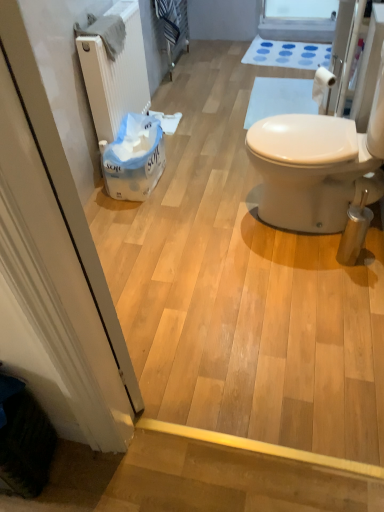
Where is `transparent plastic window screen at upper center`? The height and width of the screenshot is (512, 384). transparent plastic window screen at upper center is located at coordinates (298, 20).

Locate an element on the screen. This screenshot has width=384, height=512. white matte screen door at left is located at coordinates (53, 266).

Identify the location of white rubber bath mat at upper center. The height and width of the screenshot is (512, 384). (287, 54).

Describe the element at coordinates (167, 121) in the screenshot. I see `white soft tissue at center, placed as the first toilet paper when sorted from back to front` at that location.

The height and width of the screenshot is (512, 384). Describe the element at coordinates (115, 74) in the screenshot. I see `beige textured radiator at left` at that location.

Identify the location of transparent plastic window screen at upper center. This screenshot has height=512, width=384. (298, 20).

Between beige textured radiator at left and white matte toilet paper at upper right, positioned as the second toilet paper in left-to-right order, which one has more height?

beige textured radiator at left is taller.

Choose the correct answer: Is beige textured radiator at left inside white matte toilet paper at upper right, which is counted as the 1th toilet paper, starting from the front, or outside it?

beige textured radiator at left is outside white matte toilet paper at upper right, which is counted as the 1th toilet paper, starting from the front.

Is beige textured radiator at left positioned with its back to white matte toilet paper at upper right, which is counted as the 1th toilet paper, starting from the front?

That's not correct — beige textured radiator at left is not looking away from white matte toilet paper at upper right, which is counted as the 1th toilet paper, starting from the front.

In the scene shown: From a real-world perspective, which object stands above the other?

white matte toilet paper at upper right, which is counted as the 1th toilet paper, starting from the front.

Considering the relative sizes of white soft tissue at center, placed as the first toilet paper when sorted from back to front, and transparent plastic window screen at upper center in the image provided, is white soft tissue at center, placed as the first toilet paper when sorted from back to front, thinner than transparent plastic window screen at upper center?

Correct, the width of white soft tissue at center, placed as the first toilet paper when sorted from back to front, is less than that of transparent plastic window screen at upper center.

Considering the relative positions of white soft tissue at center, the 2th toilet paper when ordered from right to left, and transparent plastic window screen at upper center in the image provided, is white soft tissue at center, the 2th toilet paper when ordered from right to left, to the left or to the right of transparent plastic window screen at upper center?

In the image, white soft tissue at center, the 2th toilet paper when ordered from right to left, appears on the left side of transparent plastic window screen at upper center.

Between white soft tissue at center, the 2th toilet paper when ordered from right to left, and transparent plastic window screen at upper center, which one has larger size?

transparent plastic window screen at upper center is bigger.

In order to click on the 1st toilet paper in front of the transparent plastic window screen at upper center in this screenshot , I will do `click(167, 121)`.

Is transparent plastic window screen at upper center aimed at white soft tissue at center, arranged as the first toilet paper when viewed from the left?

Yes.

Can you confirm if transparent plastic window screen at upper center is taller than white soft tissue at center, arranged as the first toilet paper when viewed from the left?

Yes.

At what (x,y) coordinates should I click in order to perform the action: click on window screen lying behind the white soft tissue at center, which is the second toilet paper in front-to-back order. Please return your answer as a coordinate pair (x, y). Looking at the image, I should click on (298, 20).

Is beige textured radiator at left looking in the opposite direction of white matte screen door at left?

No.

From the image's perspective, which object appears higher, beige textured radiator at left or white matte screen door at left?

beige textured radiator at left.

Considering the sizes of beige textured radiator at left and white matte screen door at left in the image, is beige textured radiator at left taller or shorter than white matte screen door at left?

Considering their sizes, beige textured radiator at left has less height than white matte screen door at left.

Are beige textured radiator at left and white matte screen door at left beside each other?

There is a gap between beige textured radiator at left and white matte screen door at left.

How many degrees apart are the facing directions of transparent plastic window screen at upper center and white rubber bath mat at upper center?

The facing directions of transparent plastic window screen at upper center and white rubber bath mat at upper center are 6.05 degrees apart.

Is transparent plastic window screen at upper center smaller than white rubber bath mat at upper center?

Incorrect, transparent plastic window screen at upper center is not smaller in size than white rubber bath mat at upper center.

Is transparent plastic window screen at upper center positioned beyond the bounds of white rubber bath mat at upper center?

Yes, transparent plastic window screen at upper center is outside of white rubber bath mat at upper center.

Looking at this image, from a real-world perspective, is transparent plastic window screen at upper center positioned under white rubber bath mat at upper center based on gravity?

No, from a real-world perspective, transparent plastic window screen at upper center is not beneath white rubber bath mat at upper center.

Based on the photo, which object is further away from the camera taking this photo, white matte toilet paper at upper right, positioned as the second toilet paper in left-to-right order, or beige textured radiator at left?

white matte toilet paper at upper right, positioned as the second toilet paper in left-to-right order.

Is white matte toilet paper at upper right, positioned as the second toilet paper in left-to-right order, completely or partially outside of beige textured radiator at left?

Absolutely, white matte toilet paper at upper right, positioned as the second toilet paper in left-to-right order, is external to beige textured radiator at left.

Which point is more distant from viewer, (331,79) or (118,112)?

Positioned behind is point (118,112).

From the image's perspective, is white matte toilet paper at upper right, marked as the 2th toilet paper in a back-to-front arrangement, over beige textured radiator at left?

No, from the image's perspective, white matte toilet paper at upper right, marked as the 2th toilet paper in a back-to-front arrangement, is not over beige textured radiator at left.

Considering the positions of point (324, 73) and point (167, 116), is point (324, 73) closer or farther from the camera than point (167, 116)?

Clearly, point (324, 73) is closer to the camera than point (167, 116).

Is white matte toilet paper at upper right, marked as the 2th toilet paper in a back-to-front arrangement, taller or shorter than white soft tissue at center, arranged as the first toilet paper when viewed from the left?

white matte toilet paper at upper right, marked as the 2th toilet paper in a back-to-front arrangement, is taller than white soft tissue at center, arranged as the first toilet paper when viewed from the left.

Considering the sizes of objects white matte toilet paper at upper right, positioned as the second toilet paper in left-to-right order, and white soft tissue at center, the 2th toilet paper when ordered from right to left, in the image provided, who is bigger, white matte toilet paper at upper right, positioned as the second toilet paper in left-to-right order, or white soft tissue at center, the 2th toilet paper when ordered from right to left,?

With larger size is white soft tissue at center, the 2th toilet paper when ordered from right to left.

At what (x,y) coordinates should I click in order to perform the action: click on the 1st toilet paper behind the beige textured radiator at left, starting your count from the anchor. Please return your answer as a coordinate pair (x, y). The image size is (384, 512). Looking at the image, I should click on click(x=322, y=83).

Identify the location of the 1st toilet paper below when counting from the transparent plastic window screen at upper center (from the image's perspective). Image resolution: width=384 pixels, height=512 pixels. (167, 121).

Which object lies further to the anchor point white matte screen door at left, beige textured radiator at left or white rubber bath mat at upper center?

The object further to white matte screen door at left is white rubber bath mat at upper center.

Estimate the real-world distances between objects in this image. Which object is further from white rubber bath mat at upper center, white matte toilet paper at upper right, the first toilet paper when ordered from right to left, or white soft tissue at center, the 2th toilet paper when ordered from right to left?

white soft tissue at center, the 2th toilet paper when ordered from right to left, is further to white rubber bath mat at upper center.

From the picture: Which object lies further to the anchor point white matte screen door at left, transparent plastic window screen at upper center or white matte toilet paper at upper right, marked as the 2th toilet paper in a back-to-front arrangement?

transparent plastic window screen at upper center lies further to white matte screen door at left than the other object.

When comparing their distances from white soft tissue at center, which is the second toilet paper in front-to-back order, does transparent plastic window screen at upper center or beige textured radiator at left seem closer?

beige textured radiator at left.

Which object lies nearer to the anchor point transparent plastic window screen at upper center, white soft tissue at center, the 2th toilet paper when ordered from right to left, or white matte screen door at left?

white soft tissue at center, the 2th toilet paper when ordered from right to left, lies closer to transparent plastic window screen at upper center than the other object.

Estimate the real-world distances between objects in this image. Which object is further from white rubber bath mat at upper center, white soft tissue at center, which is the second toilet paper in front-to-back order, or white matte screen door at left?

Among the two, white matte screen door at left is located further to white rubber bath mat at upper center.

Looking at the image, which one is located closer to white matte toilet paper at upper right, the first toilet paper when ordered from right to left, beige textured radiator at left or white soft tissue at center, arranged as the first toilet paper when viewed from the left?

Among the two, white soft tissue at center, arranged as the first toilet paper when viewed from the left, is located nearer to white matte toilet paper at upper right, the first toilet paper when ordered from right to left.

Based on their spatial positions, is beige textured radiator at left or transparent plastic window screen at upper center closer to white matte screen door at left?

beige textured radiator at left.

Where is `toilet paper located between white matte screen door at left and white soft tissue at center, the 2th toilet paper when ordered from right to left, in the depth direction`? The height and width of the screenshot is (512, 384). toilet paper located between white matte screen door at left and white soft tissue at center, the 2th toilet paper when ordered from right to left, in the depth direction is located at coordinates (322, 83).

The height and width of the screenshot is (512, 384). I want to click on bath mat located between white matte screen door at left and transparent plastic window screen at upper center in the depth direction, so click(x=287, y=54).

Find the location of a particular element. The width and height of the screenshot is (384, 512). toilet paper positioned between white matte toilet paper at upper right, the first toilet paper when ordered from right to left, and transparent plastic window screen at upper center from near to far is located at coordinates (167, 121).

I want to click on radiator between white matte screen door at left and transparent plastic window screen at upper center along the z-axis, so click(115, 74).